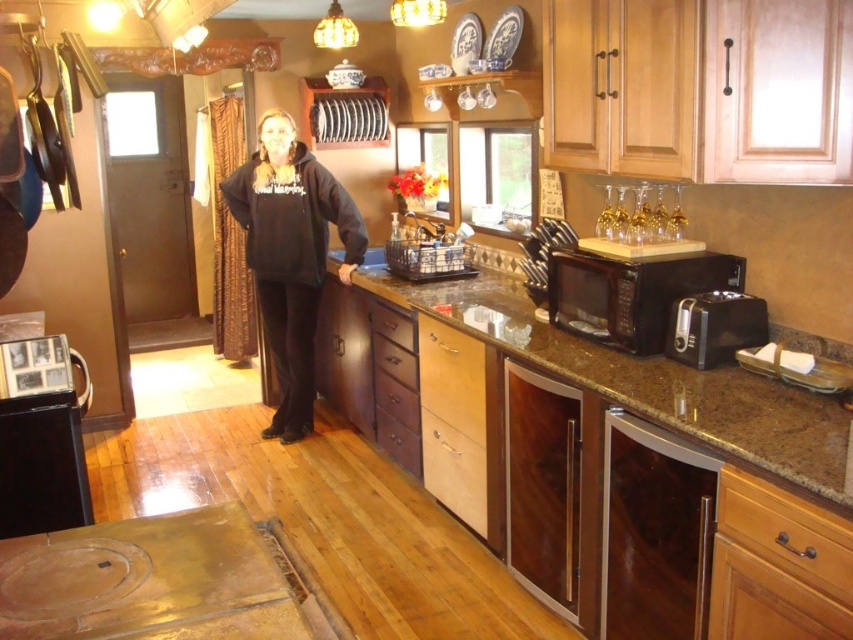
Does satin stainless steel dishwasher at lower right have a greater height compared to black fleece hoodie at center?

No, satin stainless steel dishwasher at lower right is not taller than black fleece hoodie at center.

Is point (606, 416) closer to camera compared to point (310, 380)?

Yes, it is in front of point (310, 380).

Locate an element on the screen. satin stainless steel dishwasher at lower right is located at coordinates (654, 531).

Can you confirm if brown granite countertop at center is positioned to the right of black plastic toaster at right?

In fact, brown granite countertop at center is to the left of black plastic toaster at right.

Who is shorter, brown granite countertop at center or black plastic toaster at right?

With less height is black plastic toaster at right.

This screenshot has height=640, width=853. I want to click on brown granite countertop at center, so point(648,381).

Locate an element on the screen. The image size is (853, 640). brown granite countertop at center is located at coordinates (648, 381).

What do you see at coordinates (631, 292) in the screenshot?
I see `black matte microwave at right` at bounding box center [631, 292].

Can you confirm if black matte microwave at right is bigger than black plastic toaster at right?

Correct, black matte microwave at right is larger in size than black plastic toaster at right.

Find the location of a particular element. black matte microwave at right is located at coordinates (631, 292).